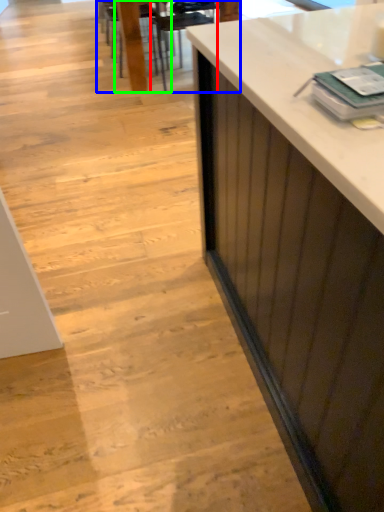
Question: Considering the real-world distances, which object is closest to armchair (highlighted by a red box)? table (highlighted by a blue box) or chair (highlighted by a green box).

Choices:
 (A) table
 (B) chair

Answer: (A)